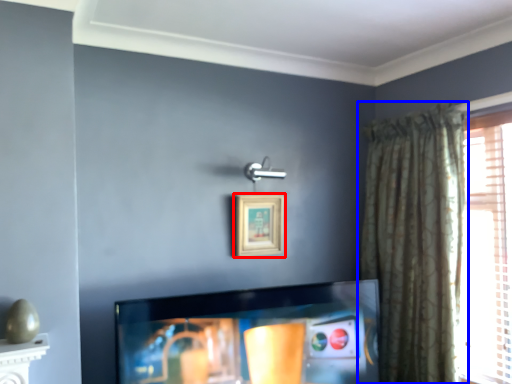
Question: Among these objects, which one is nearest to the camera, picture frame (highlighted by a red box) or curtain (highlighted by a blue box)?

Choices:
 (A) picture frame
 (B) curtain

Answer: (B)